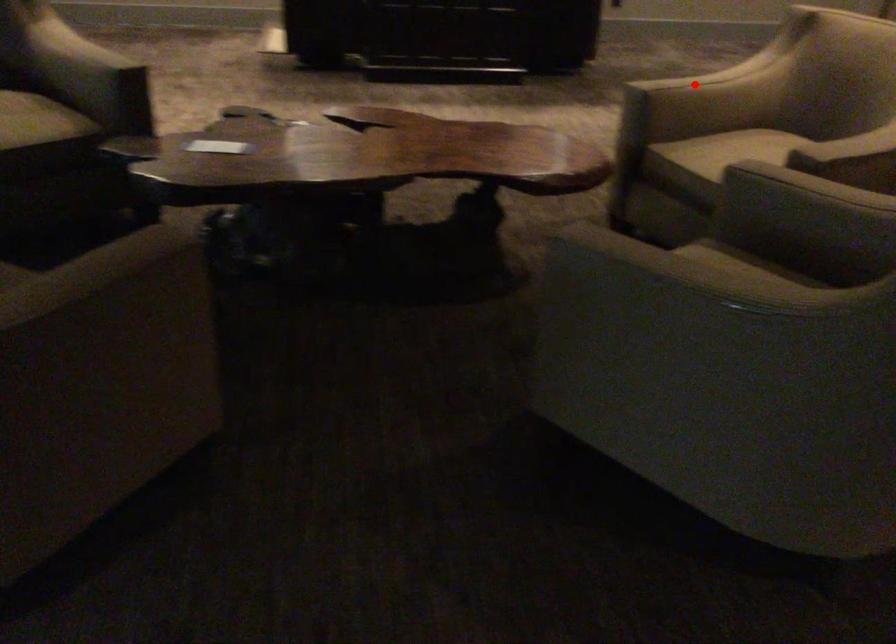
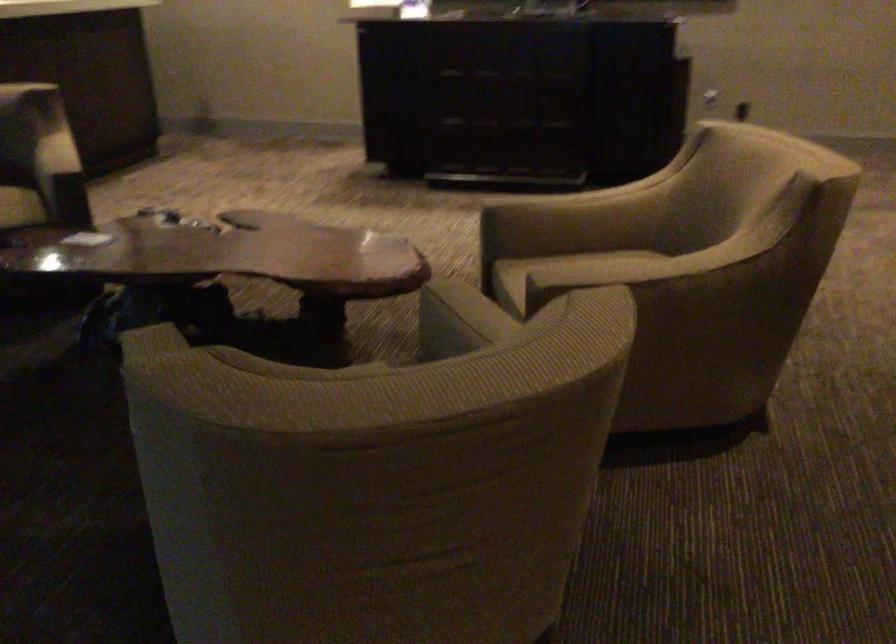
Locate, in the second image, the point that corresponds to the highlighted location in the first image.

(547, 200)